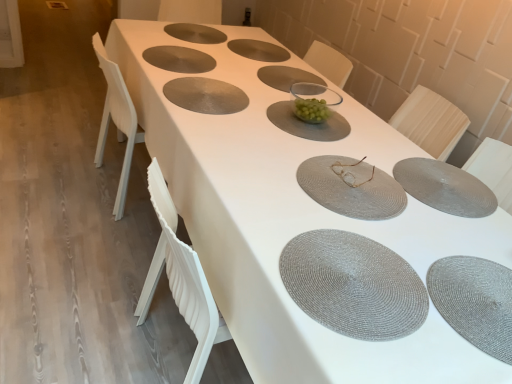
What are the coordinates of `free area in between gray woven placemat at center and clear glass bowl at center, arranged as the 6th tableware when ordered from the bottom` in the screenshot? It's located at (257, 105).